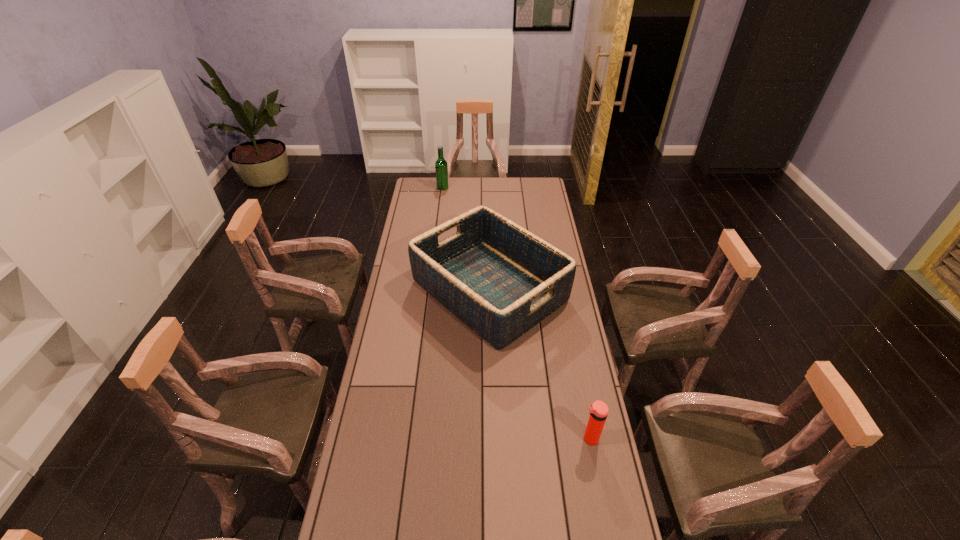
At what (x,y) coordinates should I click in order to perform the action: click on basket present at the right edge. Please return your answer as a coordinate pair (x, y). The height and width of the screenshot is (540, 960). Looking at the image, I should click on (499, 279).

The image size is (960, 540). In order to click on thermos bottle at the right edge in this screenshot , I will do `click(598, 411)`.

In order to click on object located at the far left corner in this screenshot , I will do `click(441, 168)`.

In the image, there is a desktop. At what (x,y) coordinates should I click in order to perform the action: click on vacant space at the far edge. Please return your answer as a coordinate pair (x, y). Image resolution: width=960 pixels, height=540 pixels. Looking at the image, I should click on (456, 187).

What are the coordinates of `free spot at the left edge of the desktop` in the screenshot? It's located at (386, 532).

Image resolution: width=960 pixels, height=540 pixels. In the image, there is a desktop. In order to click on vacant space at the right edge in this screenshot , I will do `click(559, 379)`.

The width and height of the screenshot is (960, 540). I want to click on vacant space at the far right corner, so click(535, 185).

The width and height of the screenshot is (960, 540). What are the coordinates of `free space between the nearest object and the basket` in the screenshot? It's located at (540, 364).

This screenshot has height=540, width=960. I want to click on object identified as the second closest to the second farthest object, so click(x=441, y=168).

The width and height of the screenshot is (960, 540). What are the coordinates of `object that can be found as the closest to the nearest object` in the screenshot? It's located at (499, 279).